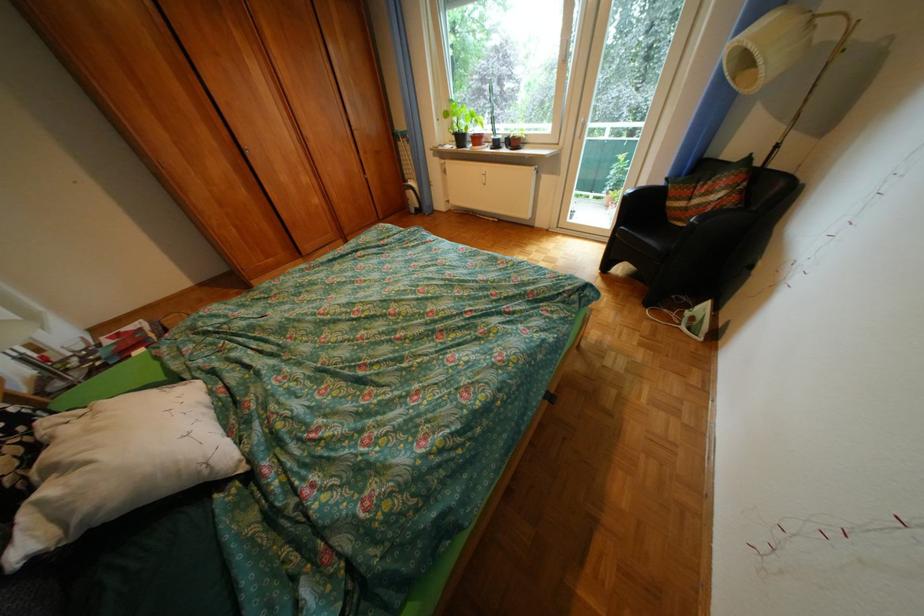
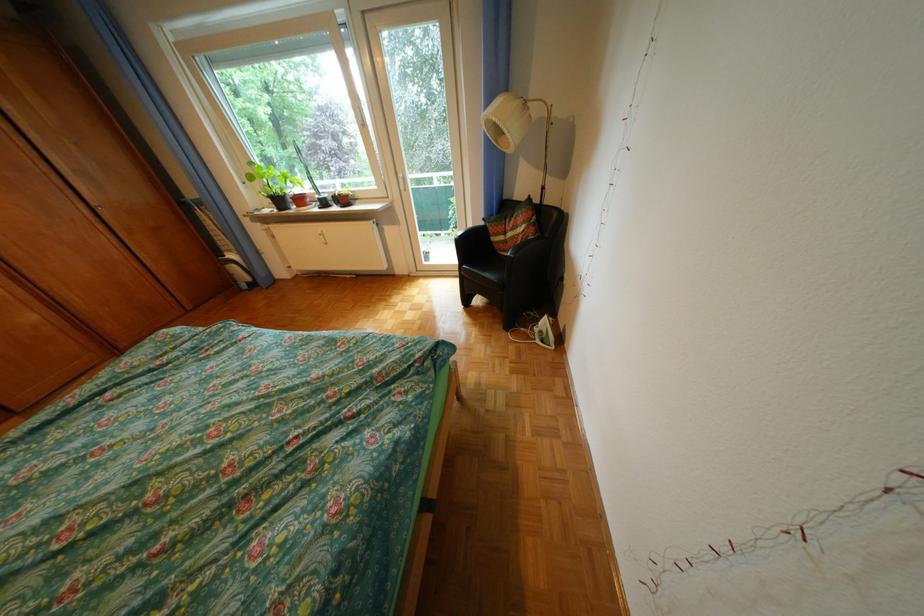
In the second image, find the point that corresponds to point (468, 138) in the first image.

(284, 201)